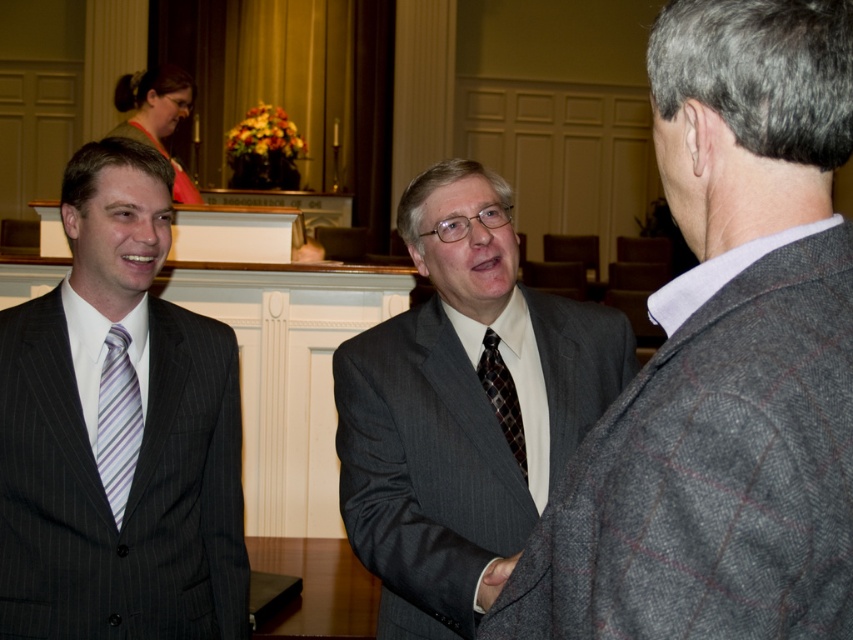
Question: Where is gray pinstripe suit at center located in relation to striped silk tie at left in the image?

Choices:
 (A) right
 (B) left

Answer: (A)

Question: Which of the following is the closest to the observer?

Choices:
 (A) pinstriped suit at left
 (B) gray pinstripe suit at center
 (C) gray textured blazer at center
 (D) dark brown textured tie at center

Answer: (C)

Question: Considering the real-world distances, which object is closest to the dark brown textured tie at center?

Choices:
 (A) gray textured blazer at center
 (B) gray pinstripe suit at center

Answer: (B)

Question: From the image, what is the correct spatial relationship of gray pinstripe suit at center in relation to striped silk tie at left?

Choices:
 (A) right
 (B) left

Answer: (A)

Question: Which object is farther from the camera taking this photo?

Choices:
 (A) gray pinstripe suit at center
 (B) dark brown textured tie at center
 (C) striped silk tie at left
 (D) pinstriped suit at left

Answer: (B)

Question: Is gray pinstripe suit at center further to camera compared to dark brown textured tie at center?

Choices:
 (A) no
 (B) yes

Answer: (A)